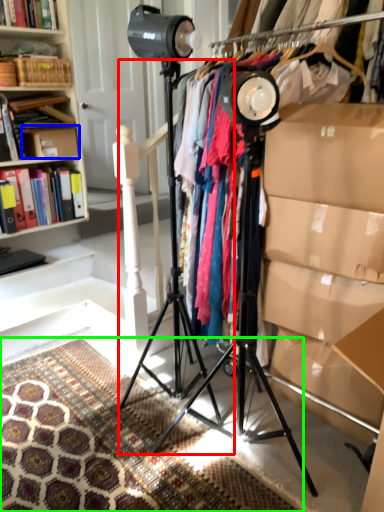
Question: Which object is the farthest from tripod (highlighted by a red box)? Choose among these: cardboard box (highlighted by a blue box) or mat (highlighted by a green box).

Choices:
 (A) cardboard box
 (B) mat

Answer: (A)